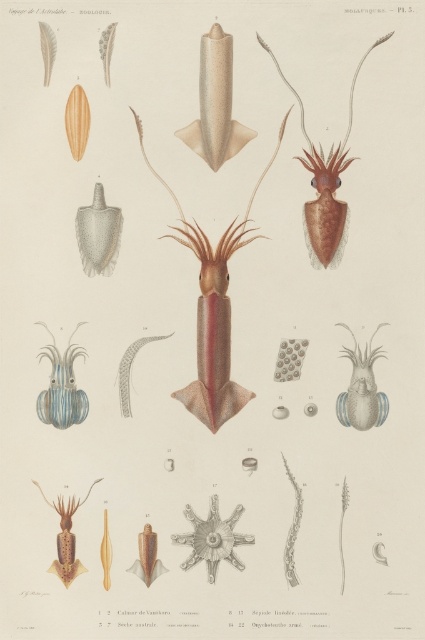
You are a marine biologist examining this illustration. You need to identify which of the two squids, the smooth brown squid at center or the matte brown squid at upper right, is taller. Based on the illustration, which one is taller?

The smooth brown squid at center is taller than the matte brown squid at upper right.

Based on the illustration from the Astrolabe expedition, which of the two squids, the matte brown squid at upper right or the blue striped squid at lower left, has a larger size?

The matte brown squid at upper right is bigger than the blue striped squid at lower left according to the illustration.